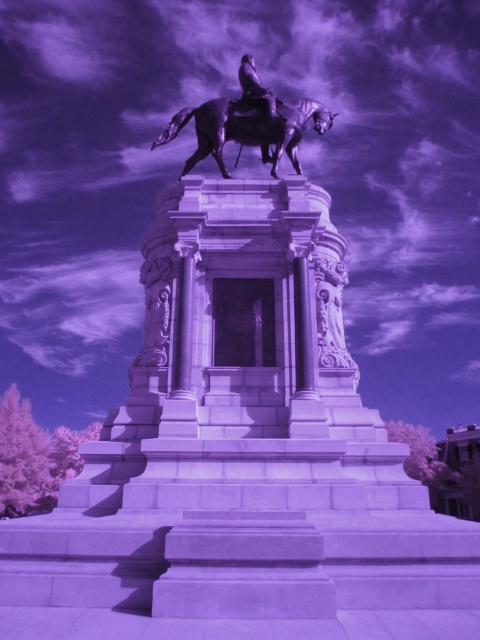
You are an art student analyzing the monument. You notice a point labeled at coordinates (248, 129). Which object does this point correspond to?

The point at coordinates (248, 129) corresponds to the polished bronze horse at center.

You are a tour guide explaining the layout of the monument to visitors. You mention the white marble statue at upper right and the shiny bronze horse at upper center. How far apart are these two landmarks in feet?

The white marble statue at upper right and the shiny bronze horse at upper center are 68.27 feet apart.